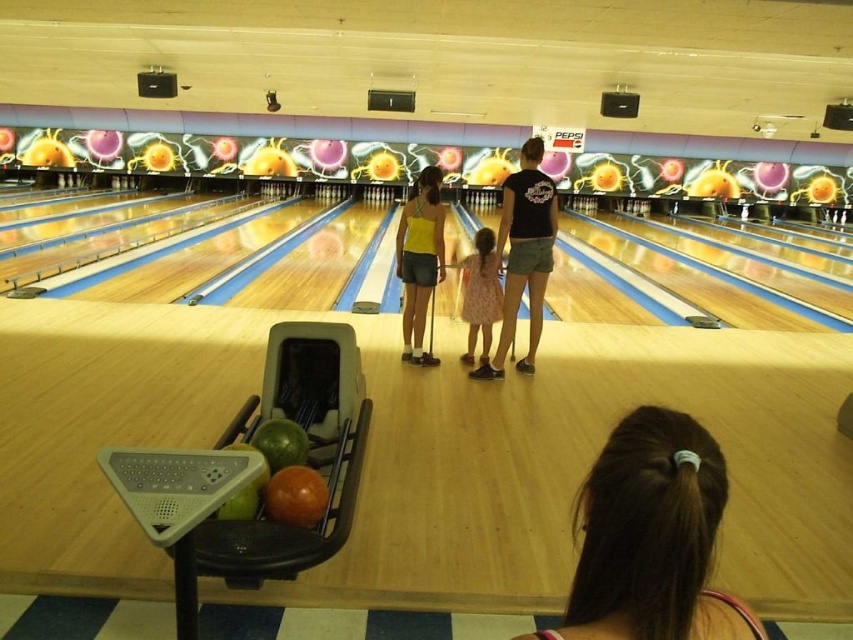
You are a customer at the bowling alley and want to choose between the yellow matte tank top at center and the dress fabric at center. Which one is easier to reach without moving from your current position?

The yellow matte tank top at center is closer to the viewer than the dress fabric at center, so it is easier to reach without moving.

You are a photographer setting up a shoot in the bowling alley. You notice a matte black shirt at center and a dress fabric at center. Which item is covering the other one?

The matte black shirt at center is positioned over dress fabric at center, so the matte black shirt at center is covering the dress fabric at center.